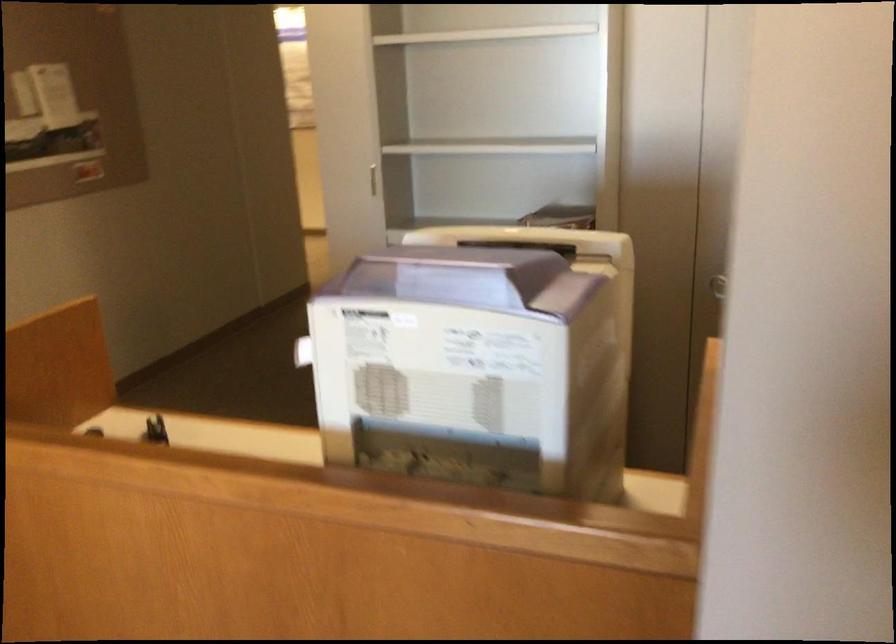
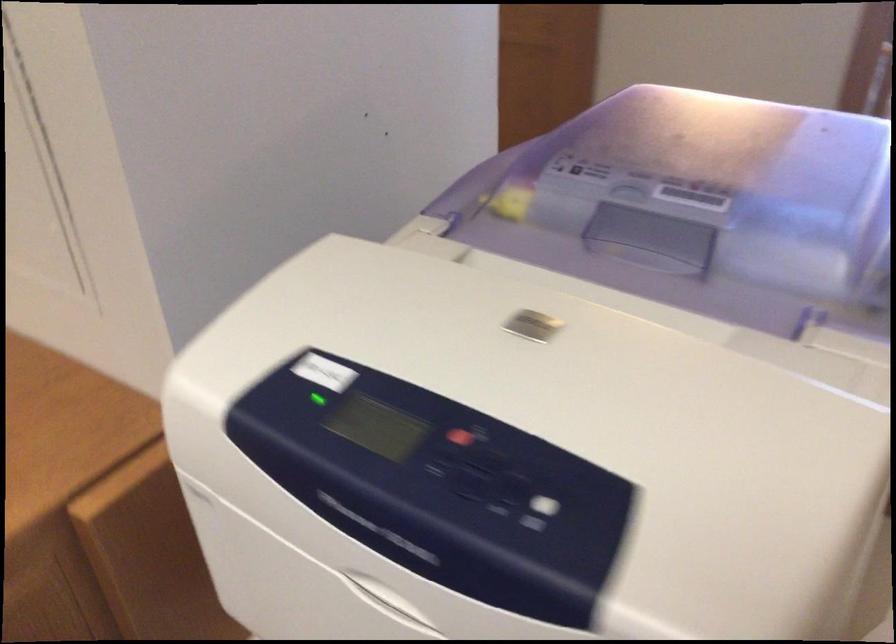
Find the pixel in the second image that matches the point at 492,229 in the first image.

(539, 325)